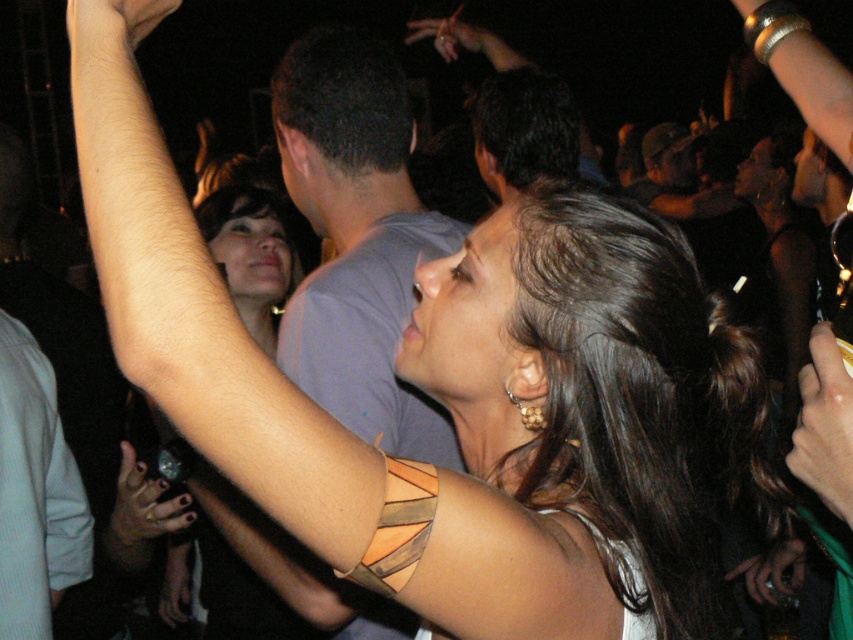
From the picture: You are a photographer at the party and want to take a photo that includes both the leather bracelet at upper left and the gray cotton shirt at center. Based on their positions, which object should you focus on first to ensure both are in the frame?

The leather bracelet at upper left is below the gray cotton shirt at center, so you should focus on the gray cotton shirt at center first to ensure both are in the frame.

You are a photographer at the party and want to take a photo of the gray cotton shirt at center and the polished silver ring at upper left. Which object should you focus on first if you want to capture both in a single shot without moving the camera?

The gray cotton shirt at center is to the right of the polished silver ring at upper left. To capture both in a single shot without moving the camera, you should focus on the polished silver ring at upper left first since it is on the left side, allowing the gray cotton shirt at center to be included in the frame to its right.

You are a photographer at the event and want to capture a closeup of the smooth gold bracelet at upper right without including the smooth skin hand at upper center in the frame. Is this possible based on their positions?

The smooth gold bracelet at upper right is not as tall as the smooth skin hand at upper center, so it is possible to frame the bracelet without including the hand by focusing on the lower part of the bracelet where it is shorter than the hand.